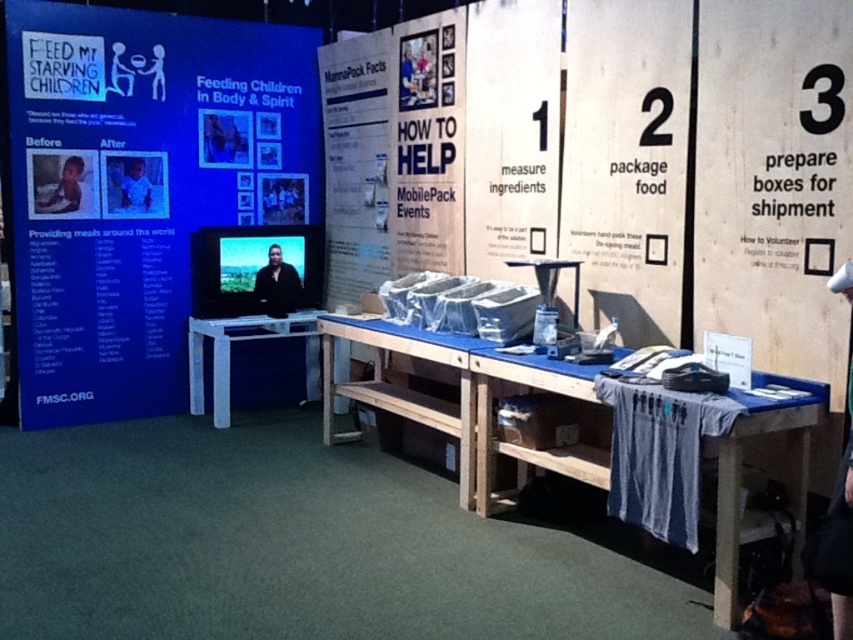
You are organizing a charity event and need to place a 12x18 inch poster. Given the white paper at center and the black matte shirt at center, which object can accommodate the poster without needing to be resized?

The white paper at center has a larger size compared to the black matte shirt at center, so the poster can be placed on the white paper at center without resizing.

You are organizing a charity event and need to place a decorative ribbon on the taller item between the white paper at center and the black matte shirt at center. Which item should you choose?

The white paper at center is taller than the black matte shirt at center, so you should place the decorative ribbon on the white paper at center.

What are the coordinates of the blue cardboard poster at left in the image?

The blue cardboard poster at left is located at coordinates point (149, 182).